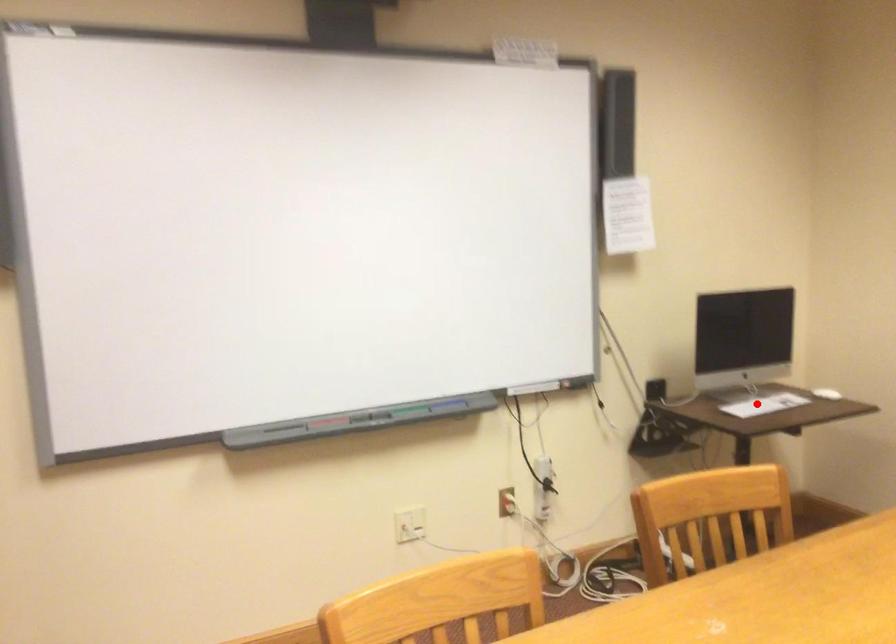
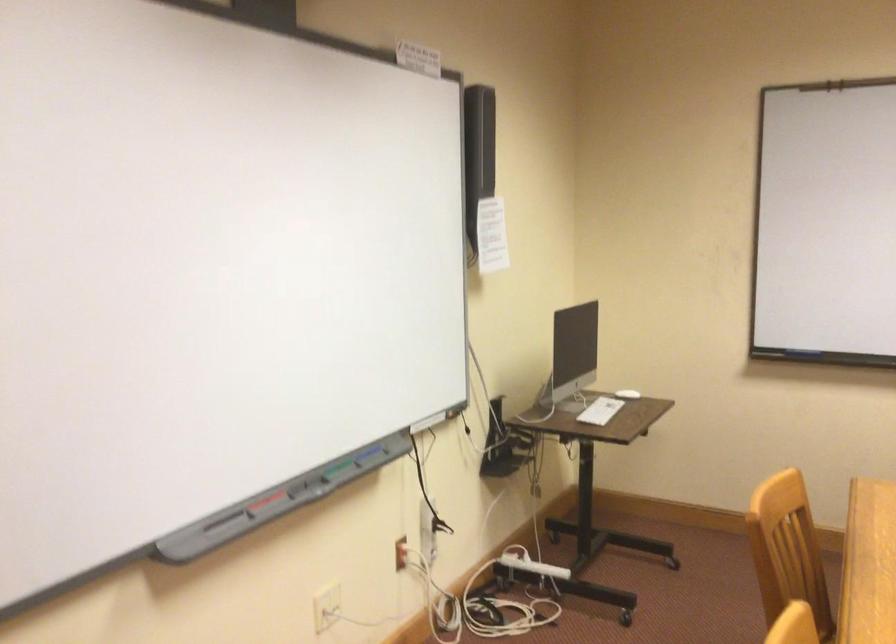
Locate, in the second image, the point that corresponds to the highlighted location in the first image.

(600, 410)